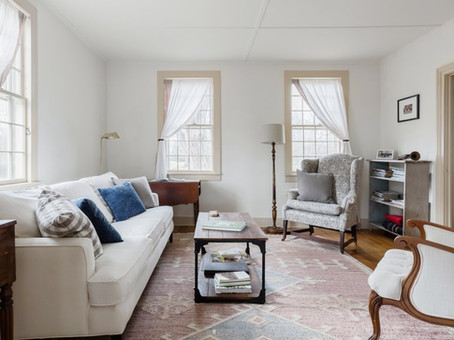
Where is `gray chair`? gray chair is located at coordinates (343, 158).